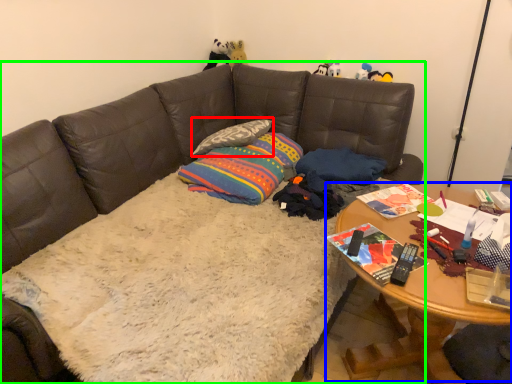
Question: Which object is positioned closest to pillow (highlighted by a red box)? Select from table (highlighted by a blue box) and studio couch (highlighted by a green box).

Choices:
 (A) table
 (B) studio couch

Answer: (B)